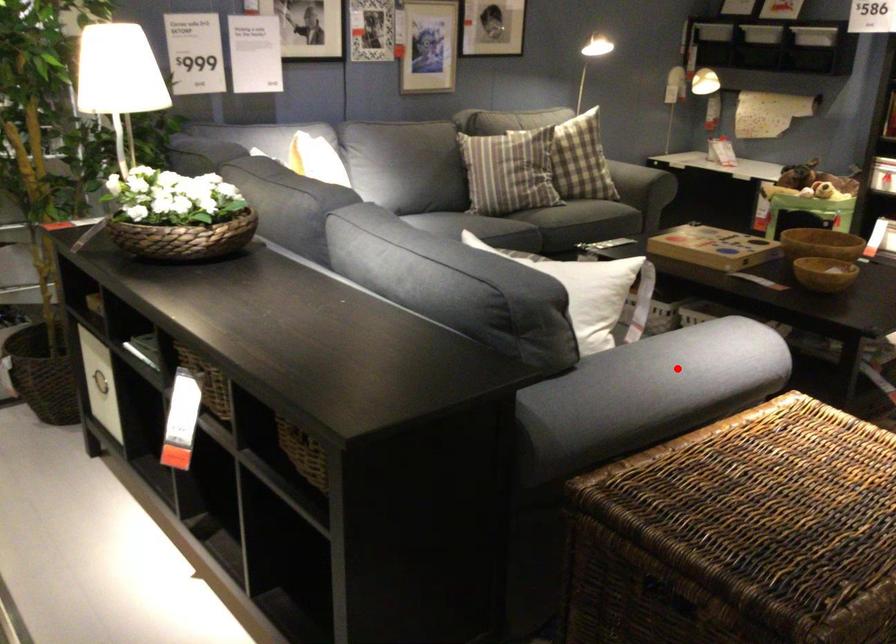
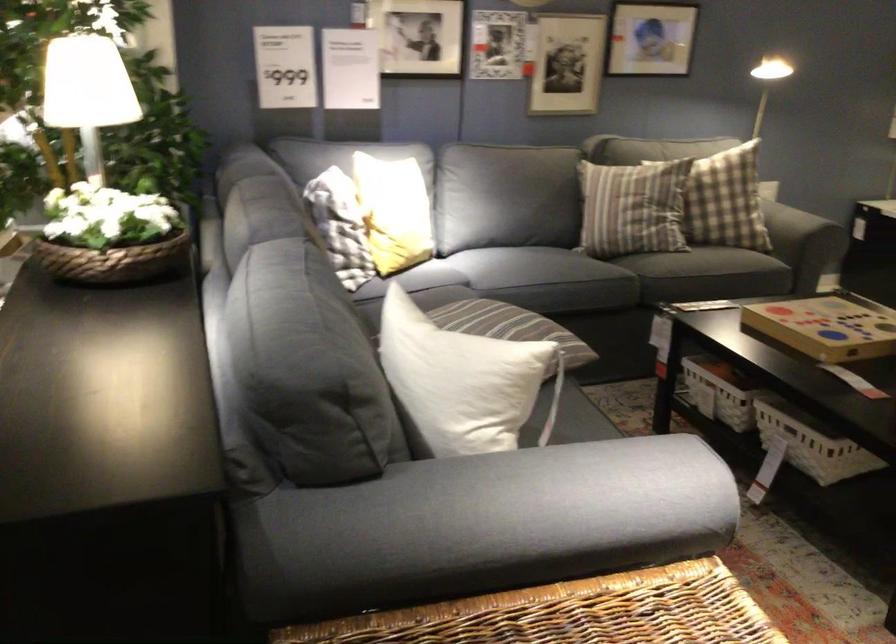
Where in the second image is the point corresponding to the highlighted location from the first image?

(528, 500)